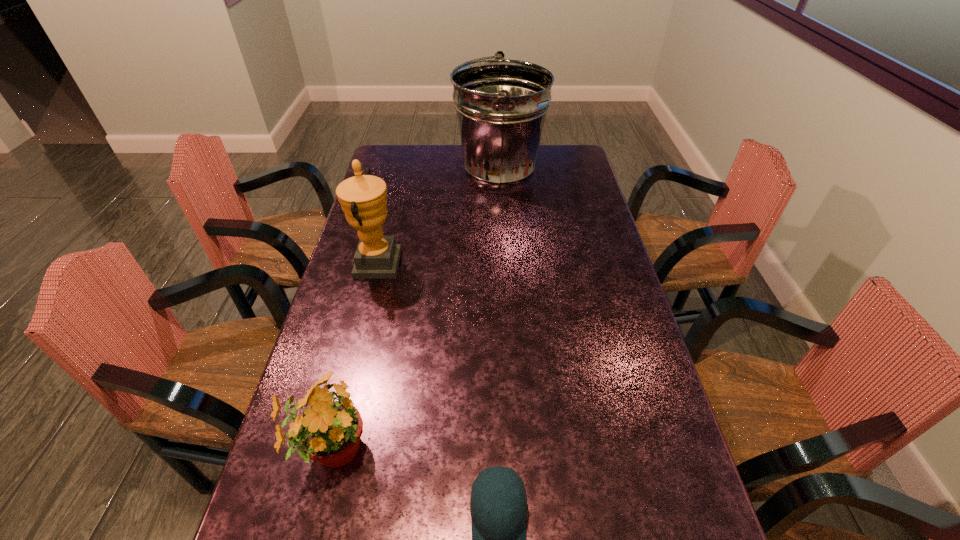
Identify the location of vacant area at the left edge of the desktop. The height and width of the screenshot is (540, 960). (351, 384).

In order to click on vacant space at the right edge in this screenshot , I will do `click(629, 322)`.

The height and width of the screenshot is (540, 960). What are the coordinates of `vacant space at the far right corner` in the screenshot? It's located at (572, 155).

The height and width of the screenshot is (540, 960). In order to click on free space that is in between the farthest object and the flowerpot in this screenshot , I will do `click(415, 311)`.

Find the location of a particular element. This screenshot has width=960, height=540. vacant space that is in between the third tallest object and the farthest object is located at coordinates (415, 311).

Point out which object is positioned as the nearest to the third nearest object. Please provide its 2D coordinates. Your answer should be formatted as a tuple, i.e. [(x, y)], where the tuple contains the x and y coordinates of a point satisfying the conditions above.

[(501, 105)]

Identify the location of object that is the closest to the shortest object. (330, 431).

This screenshot has height=540, width=960. In order to click on free point that satisfies the following two spatial constraints: 1. at the front of the third nearest object with handles; 2. on the front side of the flowerpot in this screenshot , I will do `click(330, 450)`.